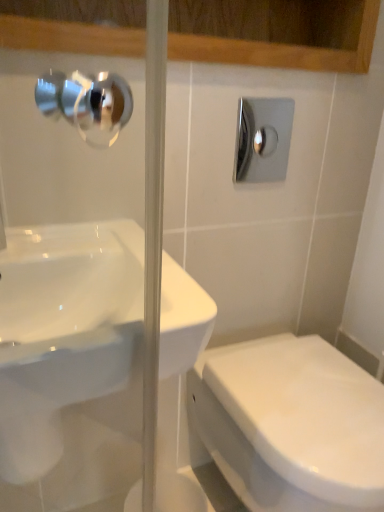
Question: In the image, is white glossy toilet at lower right positioned in front of or behind polished chrome shower at upper right?

Choices:
 (A) behind
 (B) front

Answer: (B)

Question: Considering the positions of white glossy toilet at lower right and polished chrome shower at upper right in the image, is white glossy toilet at lower right taller or shorter than polished chrome shower at upper right?

Choices:
 (A) tall
 (B) short

Answer: (A)

Question: Based on their relative distances, which object is nearer to the polished chrome shower at upper right?

Choices:
 (A) white glossy toilet at lower right
 (B) white glossy sink at center

Answer: (B)

Question: Which object is positioned closest to the white glossy sink at center?

Choices:
 (A) white glossy toilet at lower right
 (B) polished chrome shower at upper right

Answer: (A)